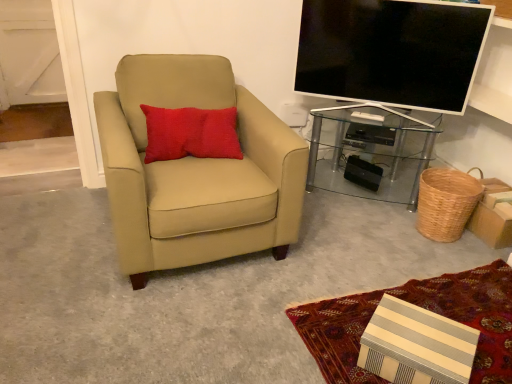
You are a GUI agent. You are given a task and a screenshot of the screen. Output one action in this format:
    pyautogui.click(x=<x>, y=<y>)
    Task: Click on the vacant space that's between transparent glass desk at right and woven brown basket at lower right
    
    Given the screenshot: What is the action you would take?
    pyautogui.click(x=376, y=215)